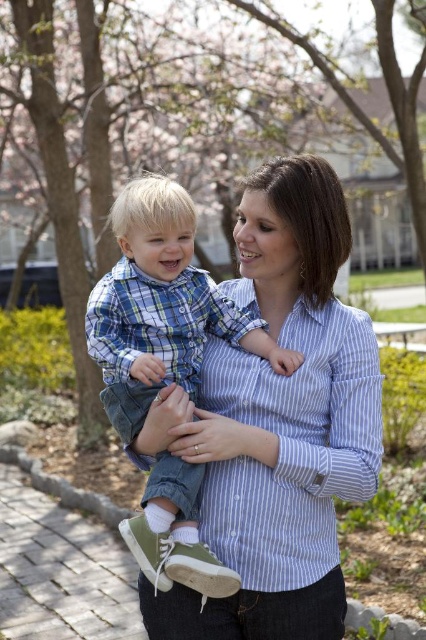
Based on the photo, you are a photographer trying to capture the perfect shot of the blue striped shirt at center and the blue plaid shirt at center. To ensure both shirts are visible in the frame, which shirt should you focus on first, the one that is higher or lower in the image?

The blue striped shirt at center is below the blue plaid shirt at center, so you should focus on the lower shirt first to ensure both are in frame.